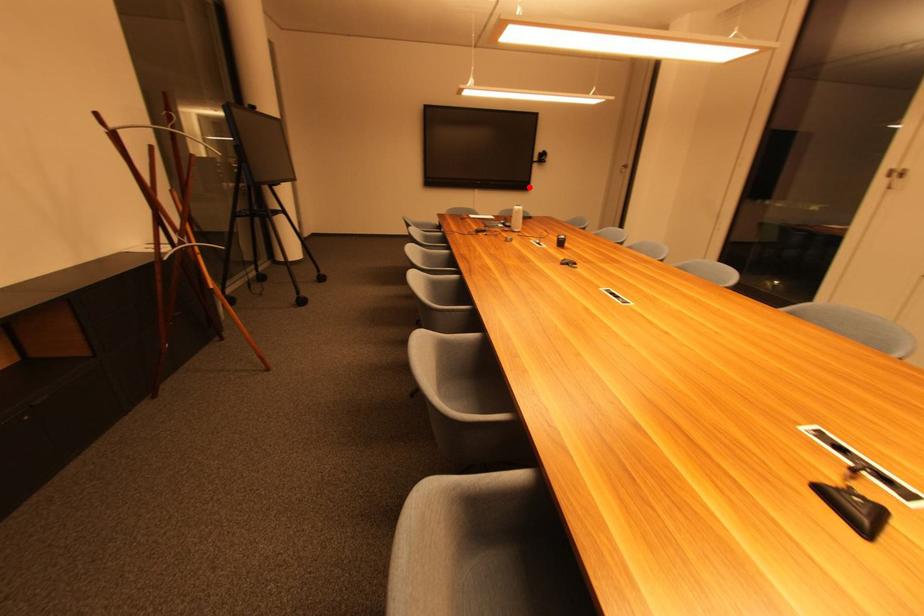
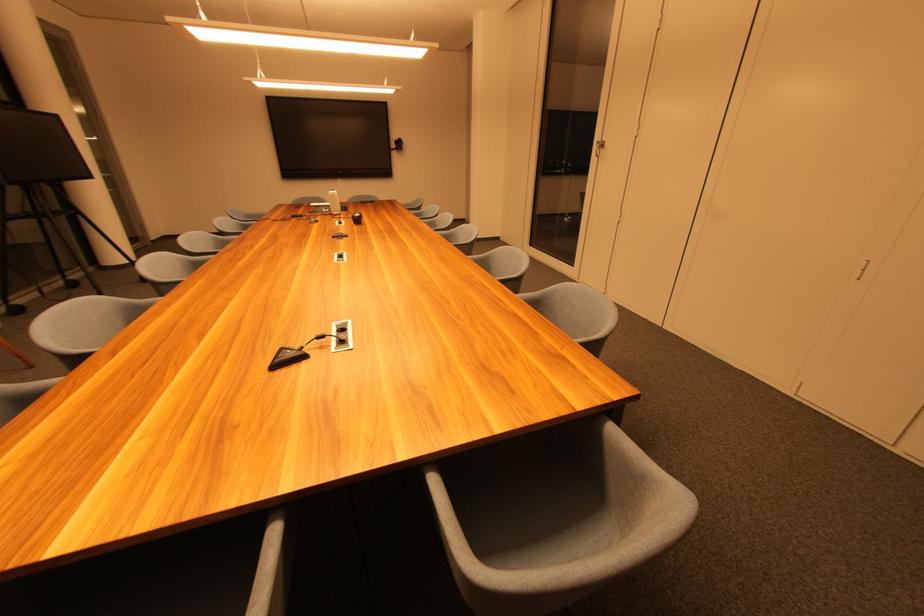
Question: I am providing you with two images of the same scene from different viewpoints. In image1, a red point is highlighted. Considering the same 3D point in image2, which of the following is correct?

Choices:
 (A) It is closer
 (B) It is farther

Answer: (A)